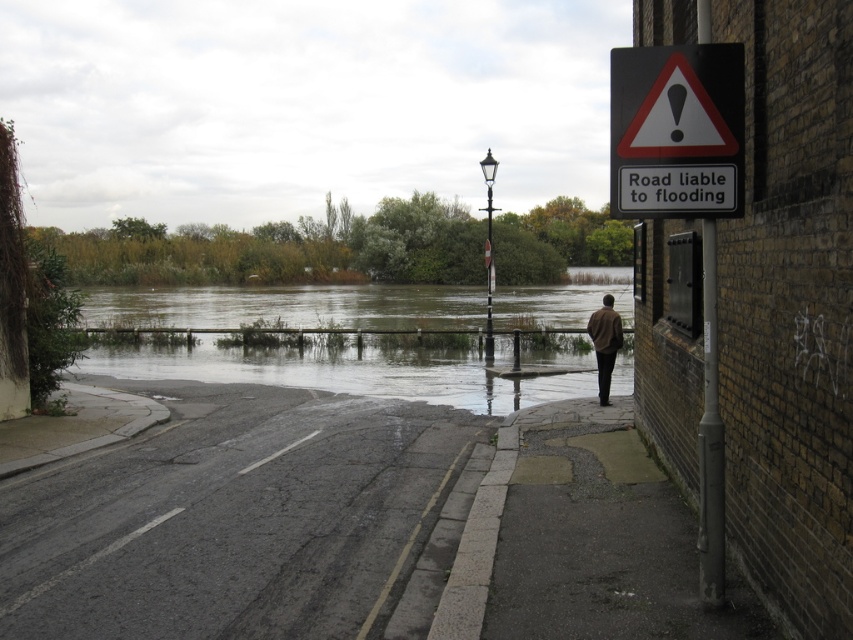
You are a delivery driver navigating through the flooded area shown in the image. You see the gray asphalt pavement at lower center and the black plastic sign at upper right. Which object is positioned higher in the image?

The black plastic sign at upper right is higher because the gray asphalt pavement at lower center is not as tall as it.

You are standing on the flooded road and see two points marked as point (735, 109) and point (614, 332). Which point is closer to you?

Point (735, 109) is closer to the viewer than point (614, 332).

You are a delivery driver who needs to navigate through the flooded street. You see the black plastic sign at upper right and the brown leather jacket at lower right. What is the minimum distance you need to maintain between these two objects to avoid getting stuck in the flooded area?

The minimum distance you need to maintain between the black plastic sign at upper right and the brown leather jacket at lower right is 10.82 meters to avoid getting stuck in the flooded area.